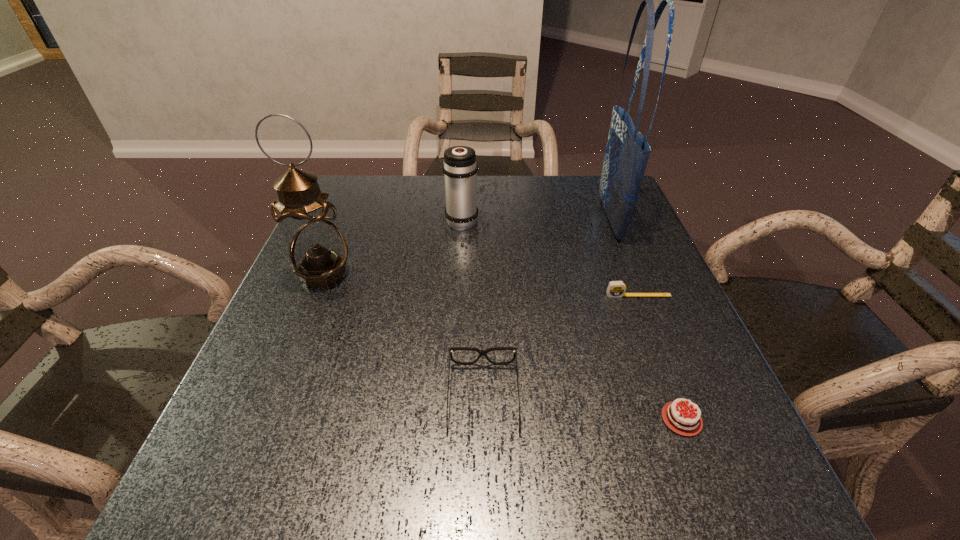
Select which object is the closest to the thermos bottle. Please provide its 2D coordinates. Your answer should be formatted as a tuple, i.e. [(x, y)], where the tuple contains the x and y coordinates of a point satisfying the conditions above.

[(317, 250)]

Find the location of a particular element. This screenshot has width=960, height=540. object that stands as the closest to the tallest object is located at coordinates (616, 289).

The width and height of the screenshot is (960, 540). Find the location of `vacant point that satisfies the following two spatial constraints: 1. with the lenses facing outward on the chocolate cake; 2. on the right side of the spectacles`. vacant point that satisfies the following two spatial constraints: 1. with the lenses facing outward on the chocolate cake; 2. on the right side of the spectacles is located at coordinates (483, 419).